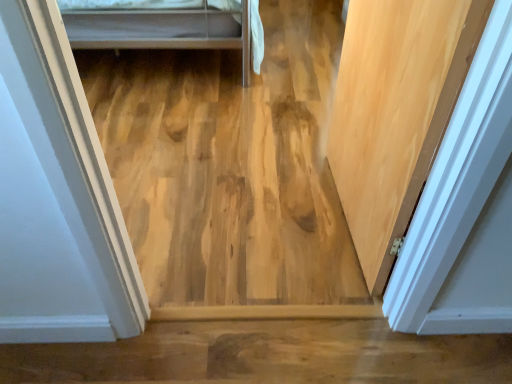
Locate an element on the screen. The width and height of the screenshot is (512, 384). blank space above natural wood plywood at center (from a real-world perspective) is located at coordinates (227, 117).